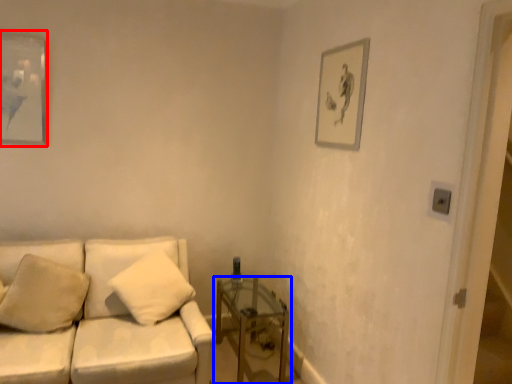
Question: Which of the following is the closest to the observer, picture frame (highlighted by a red box) or table (highlighted by a blue box)?

Choices:
 (A) picture frame
 (B) table

Answer: (B)